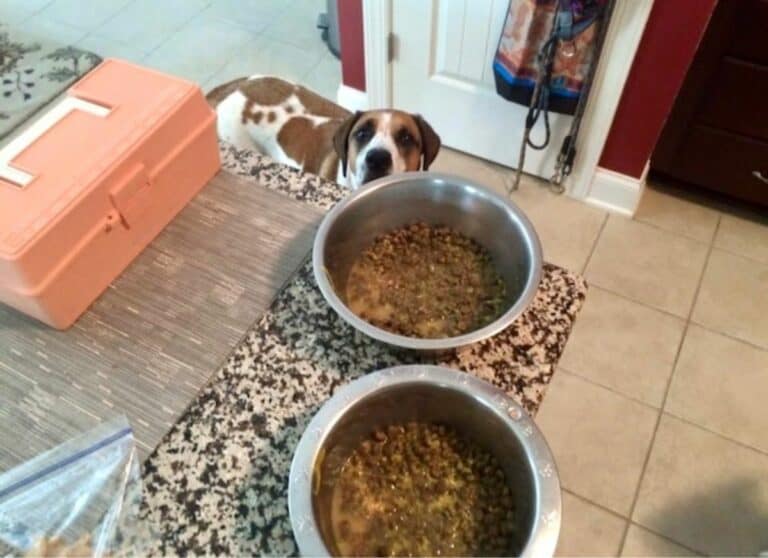
Identify the location of dark brown drawers. Image resolution: width=768 pixels, height=558 pixels. (743, 125).